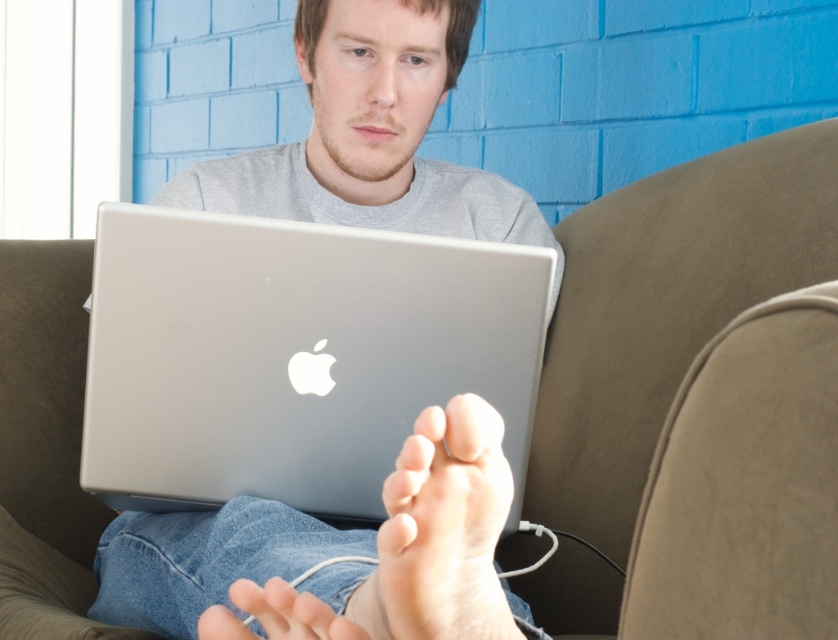
Between point (171, 282) and point (479, 531), which one is positioned behind?

The point (171, 282) is more distant.

Is silver metallic laptop at center above pale skin foot at lower center?

Yes, silver metallic laptop at center is above pale skin foot at lower center.

Is point (357, 323) positioned before point (376, 572)?

That is False.

Image resolution: width=838 pixels, height=640 pixels. In order to click on silver metallic laptop at center in this screenshot , I will do `click(293, 356)`.